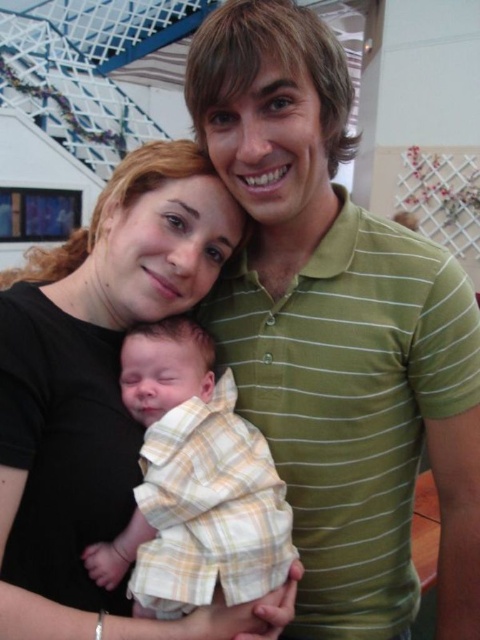
In the scene shown: Does green striped polo shirt at center have a lesser width compared to yellow plaid shirt at center?

No, green striped polo shirt at center is not thinner than yellow plaid shirt at center.

Between green striped polo shirt at center and yellow plaid shirt at center, which one appears on the left side from the viewer's perspective?

yellow plaid shirt at center

Which is in front, point (247, 284) or point (170, 372)?

Point (170, 372) is more forward.

Locate an element on the screen. This screenshot has height=640, width=480. green striped polo shirt at center is located at coordinates (337, 332).

Is point (46, 499) less distant than point (179, 456)?

No, (46, 499) is behind (179, 456).

Image resolution: width=480 pixels, height=640 pixels. In order to click on black matte shirt at center in this screenshot , I will do `click(100, 396)`.

Does point (82, 589) come in front of point (181, 340)?

Yes, it is in front of point (181, 340).

Identify the location of black matte shirt at center. [x=100, y=396].

Between green striped polo shirt at center and black matte shirt at center, which one has more height?

Standing taller between the two is green striped polo shirt at center.

Is point (408, 548) positioned behind point (59, 636)?

Yes.

This screenshot has height=640, width=480. I want to click on green striped polo shirt at center, so pyautogui.click(x=337, y=332).